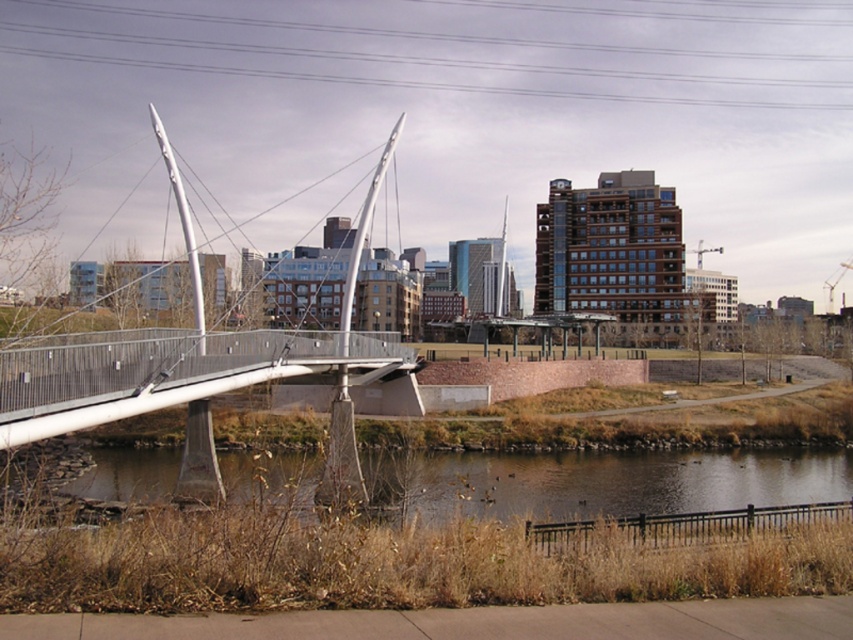
Does polished steel bridge at left appear over brown grassy river at lower center?

Yes, polished steel bridge at left is above brown grassy river at lower center.

Between polished steel bridge at left and brown grassy river at lower center, which one appears on the left side from the viewer's perspective?

Positioned to the left is polished steel bridge at left.

The height and width of the screenshot is (640, 853). Find the location of `polished steel bridge at left`. polished steel bridge at left is located at coordinates (195, 369).

Where is `polished steel bridge at left`? This screenshot has width=853, height=640. polished steel bridge at left is located at coordinates (195, 369).